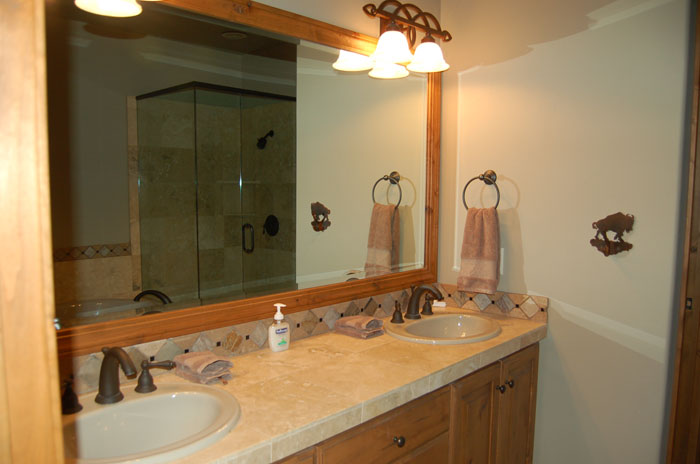
Locate an element on the screen. Image resolution: width=700 pixels, height=464 pixels. large bathroom mirror is located at coordinates (214, 155).